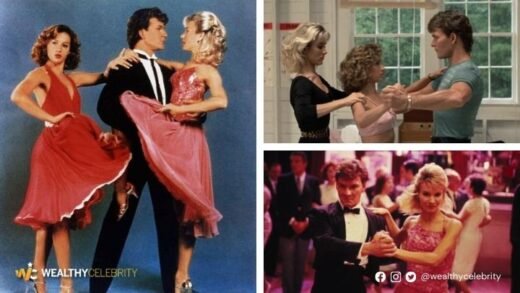
I want to click on shade, so click(x=380, y=5).